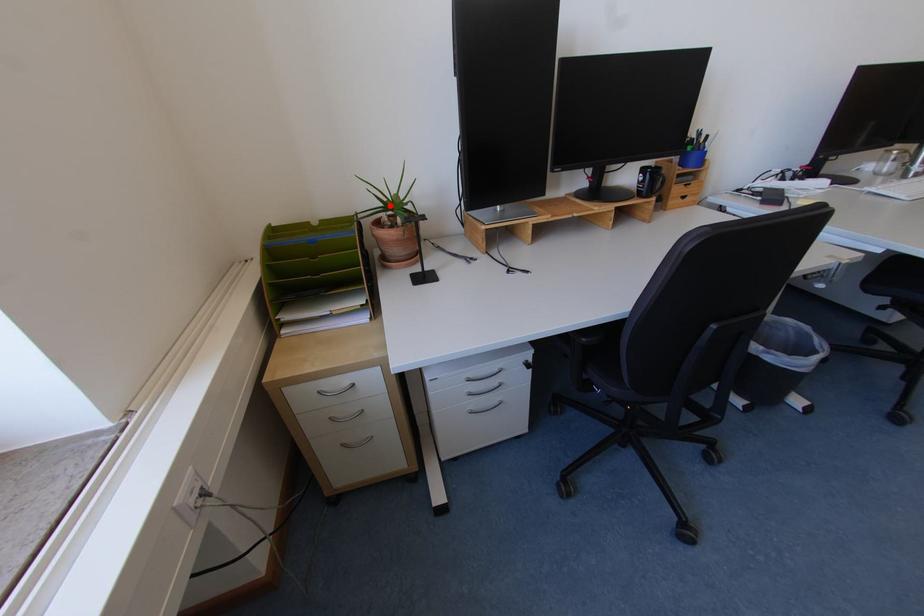
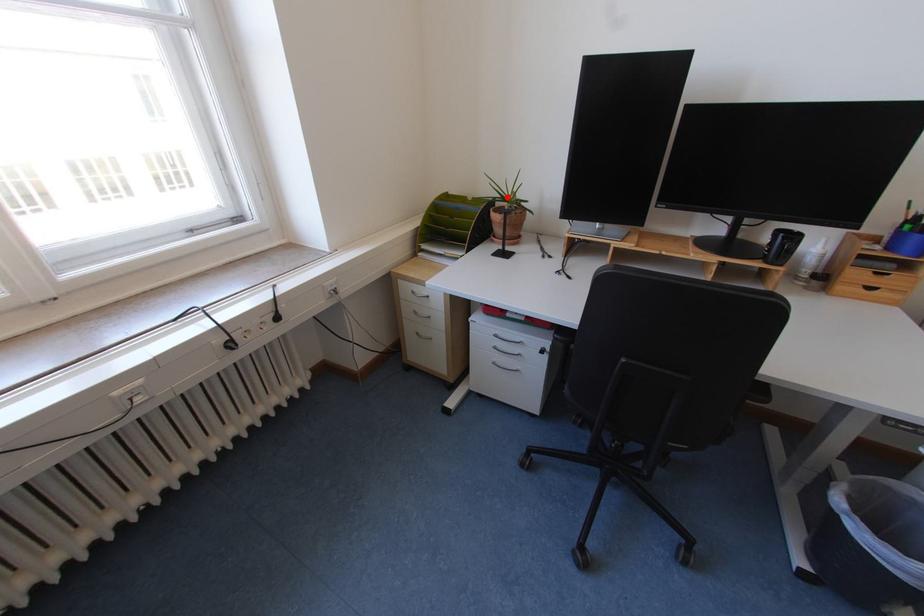
I am providing you with two images of the same scene from different viewpoints. A red point is marked on the first image and another point is marked on the second image. Is the red point in image1 aligned with the point shown in image2?

Yes